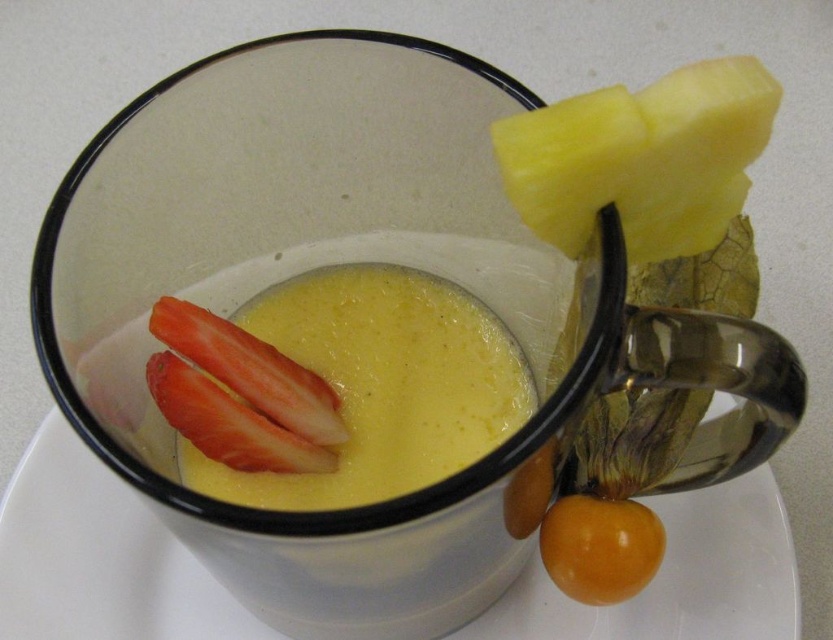
You are a food stylist arranging a dessert photo shoot. You need to place a small chocolate decoration between the orange glossy physalis at lower right and the red matte strawberry at lower left. Based on their positions, which fruit should the chocolate decoration be closer to?

The orange glossy physalis at lower right is positioned on the right side of the red matte strawberry at lower left. Therefore, the chocolate decoration should be placed closer to the orange glossy physalis at lower right since it is to the right of the strawberry.

From the picture: You are a food stylist arranging garnishes on a dessert plate. The dessert is in a glass mug with black rim. You have two garnishes to place near the mug. The yellow smooth pineapple at upper right and orange glossy physalis at lower right. According to the current arrangement, which garnish is positioned to the left of the other?

The yellow smooth pineapple at upper right is to the left of orange glossy physalis at lower right.

In the scene shown: You are a food stylist arranging the dessert in the glass mug. You want to ensure that the orange glossy physalis at lower right and the red matte strawberry at lower left are visible to the customer. Based on their positions, which fruit should be placed higher to make both visible?

The orange glossy physalis at lower right is located below the red matte strawberry at lower left. To make both visible, the red matte strawberry at lower left should be placed higher than the orange glossy physalis at lower right so that they don not block each other.